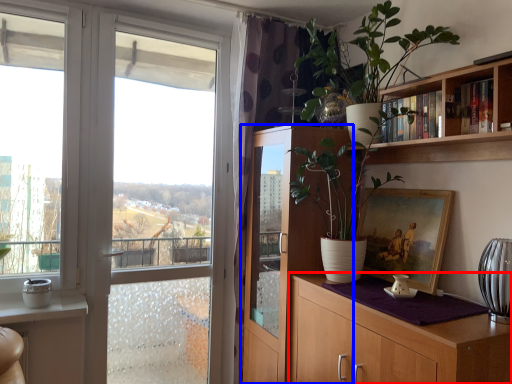
Question: Which object is further to the camera taking this photo, cabinetry (highlighted by a red box) or cabinetry (highlighted by a blue box)?

Choices:
 (A) cabinetry
 (B) cabinetry

Answer: (B)